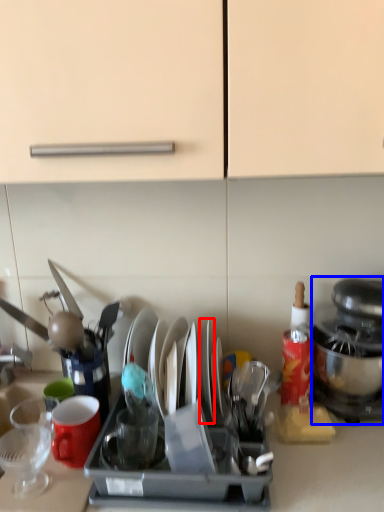
Question: Among these objects, which one is nearest to the camera, tableware (highlighted by a red box) or kitchen appliance (highlighted by a blue box)?

Choices:
 (A) tableware
 (B) kitchen appliance

Answer: (B)